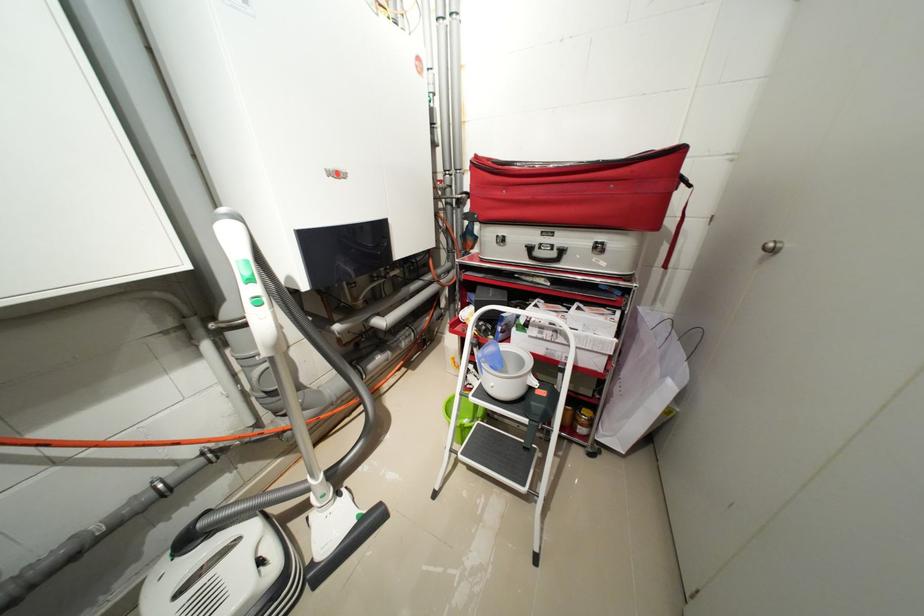
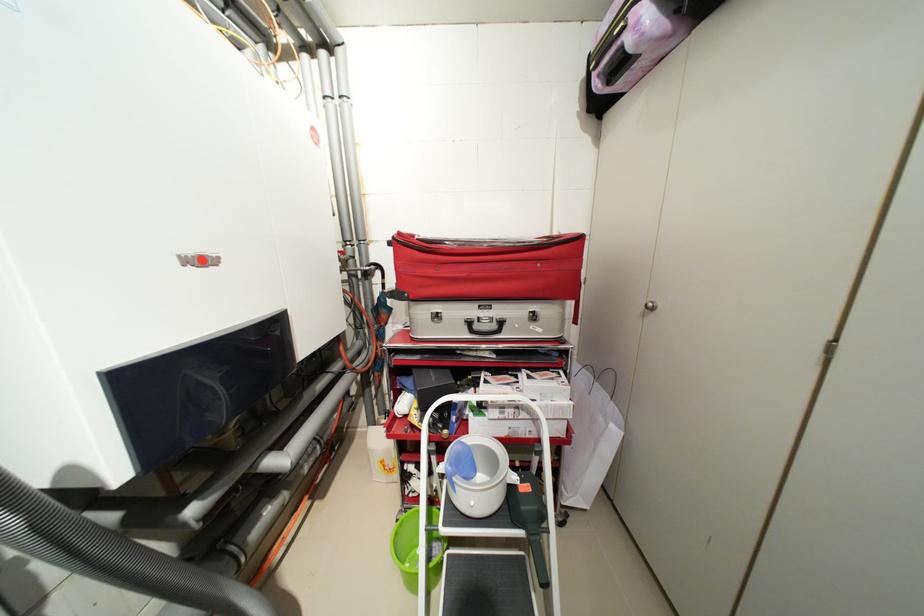
In the second image, find the point that corresponds to point 483,158 in the first image.

(407, 235)